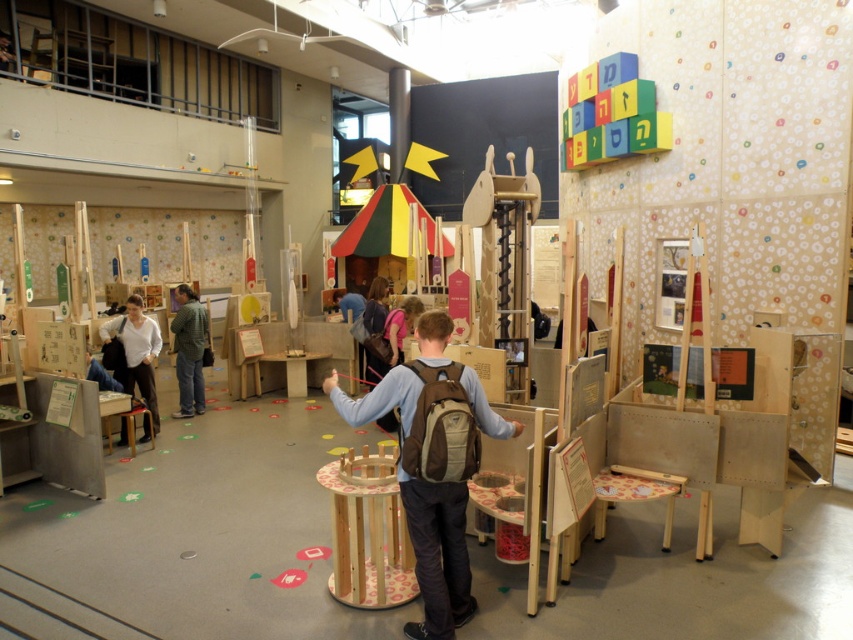
Question: Can you confirm if brown fabric backpack at center is thinner than matte white shirt at left?

Choices:
 (A) yes
 (B) no

Answer: (B)

Question: Is brown fabric backpack at center behind green matte jacket at center?

Choices:
 (A) no
 (B) yes

Answer: (A)

Question: Is brown fabric backpack at center above green matte jacket at center?

Choices:
 (A) no
 (B) yes

Answer: (A)

Question: Which point is closer to the camera taking this photo?

Choices:
 (A) (148, 374)
 (B) (459, 572)

Answer: (B)

Question: Which object is the closest to the matte white shirt at left?

Choices:
 (A) brown fabric backpack at center
 (B) multicolored wooden blocks at upper right
 (C) green matte jacket at center

Answer: (C)

Question: Which object is closer to the camera taking this photo?

Choices:
 (A) matte white shirt at left
 (B) multicolored wooden blocks at upper right

Answer: (B)